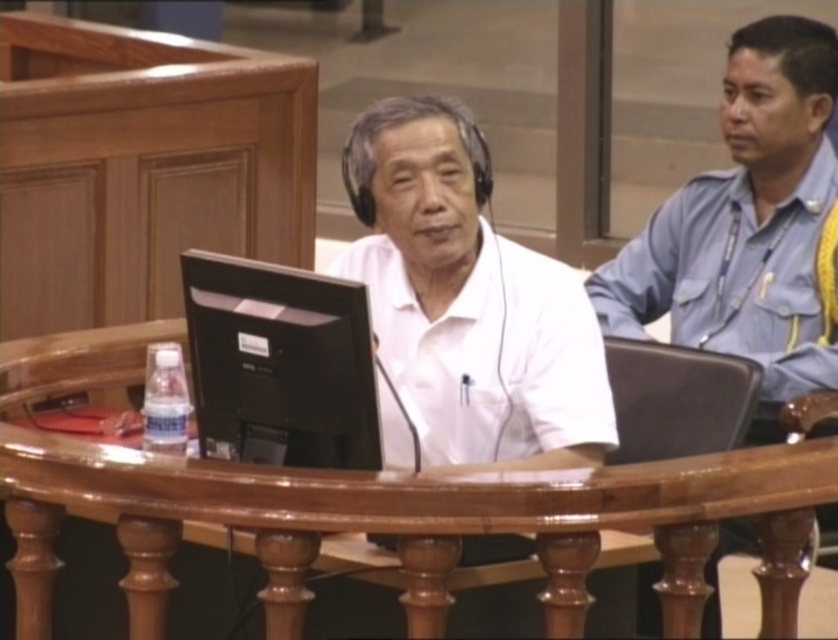
You are an interior designer assessing the courtroom layout. You need to determine if the white matte shirt at center will block the view of the black matte monitor at center from the judge sitting at the bench. Based on their heights, can the judge see the monitor?

The white matte shirt at center has a greater height compared to the black matte monitor at center. Since the shirt is taller, it could potentially block the judge from seeing the monitor.

Looking at this image, you are a security officer in the courtroom and need to locate the person wearing the white matte shirt at center. According to the coordinates provided, where exactly would you find this shirt?

The white matte shirt at center is located at point (464, 304).